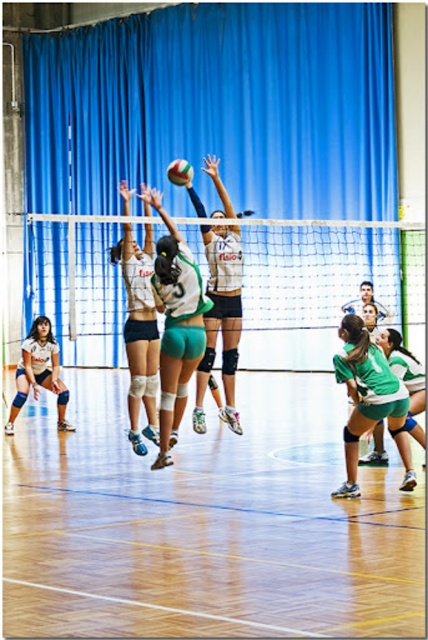
This screenshot has width=428, height=640. What do you see at coordinates (220, 317) in the screenshot?
I see `white jersey at center` at bounding box center [220, 317].

Is white jersey at center taller than matte white jersey at center?

Indeed, white jersey at center has a greater height compared to matte white jersey at center.

What do you see at coordinates (220, 317) in the screenshot? The width and height of the screenshot is (428, 640). I see `white jersey at center` at bounding box center [220, 317].

In order to click on white jersey at center in this screenshot , I will do `click(220, 317)`.

Between wooden floor at center and white jersey at center, which one is positioned higher?

Positioned higher is white jersey at center.

Is point (61, 451) farther from viewer compared to point (217, 323)?

Yes, it is.

Is point (214, 611) positioned after point (223, 419)?

No, it is in front of (223, 419).

Identify the location of wooden floor at center. (205, 524).

Does point (139, 340) lie behind point (14, 413)?

That is False.

Image resolution: width=428 pixels, height=640 pixels. What are the coordinates of `matte white jersey at center` in the screenshot? It's located at (139, 332).

Who is more distant from viewer, (148, 225) or (11, 420)?

Point (11, 420)

The height and width of the screenshot is (640, 428). Identify the location of matte white jersey at center. (139, 332).